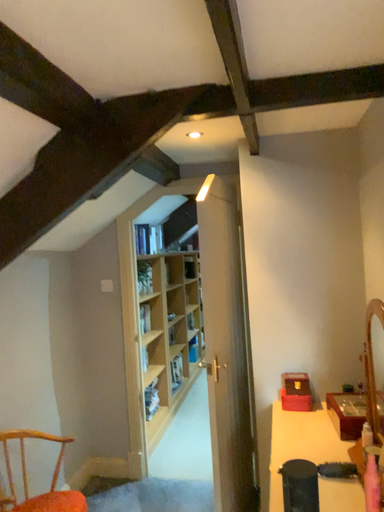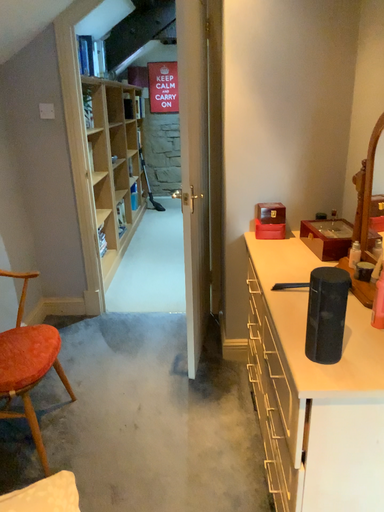
Question: How did the camera likely rotate when shooting the video?

Choices:
 (A) rotated downward
 (B) rotated upward

Answer: (A)